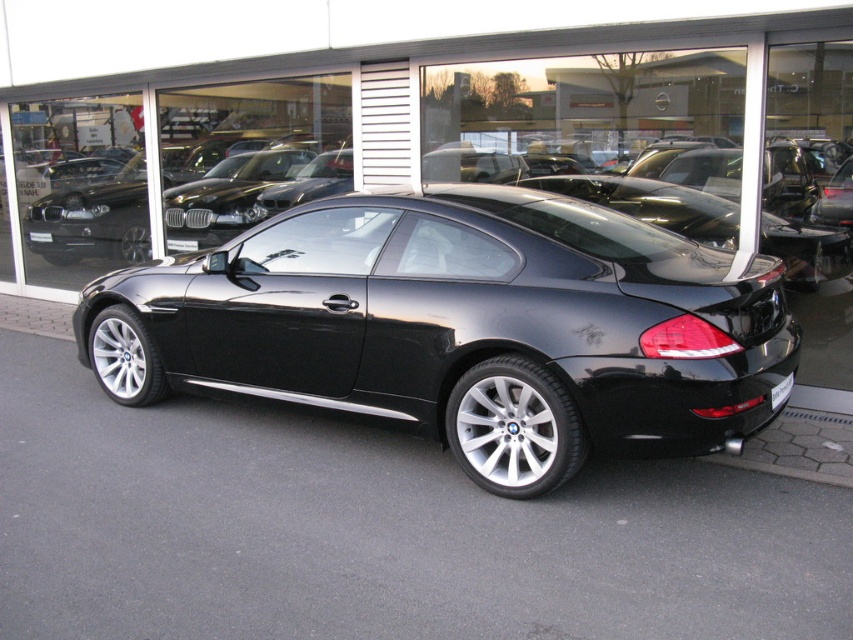
Is point (109, 358) behind point (180, 252)?

No, (109, 358) is closer to viewer.

Does black metallic car at center appear on the left side of white plastic license plate at center?

Incorrect, black metallic car at center is not on the left side of white plastic license plate at center.

Measure the distance between black metallic car at center and camera.

black metallic car at center is 3.59 meters away from camera.

The width and height of the screenshot is (853, 640). Find the location of `black metallic car at center`. black metallic car at center is located at coordinates (462, 326).

Can you confirm if glossy black car at center is positioned to the left of black metallic car at center?

Correct, you'll find glossy black car at center to the left of black metallic car at center.

Between glossy black car at center and black metallic car at center, which one is positioned lower?

Positioned lower is black metallic car at center.

The image size is (853, 640). What do you see at coordinates (399, 109) in the screenshot? I see `glossy black car at center` at bounding box center [399, 109].

This screenshot has height=640, width=853. I want to click on glossy black car at center, so click(x=399, y=109).

Does black metallic car at center have a larger size compared to black plastic license plate at rear?

Correct, black metallic car at center is larger in size than black plastic license plate at rear.

Does black metallic car at center have a smaller size compared to black plastic license plate at rear?

No.

Does point (165, 349) lie behind point (776, 392)?

Yes, point (165, 349) is behind point (776, 392).

I want to click on black metallic car at center, so click(462, 326).